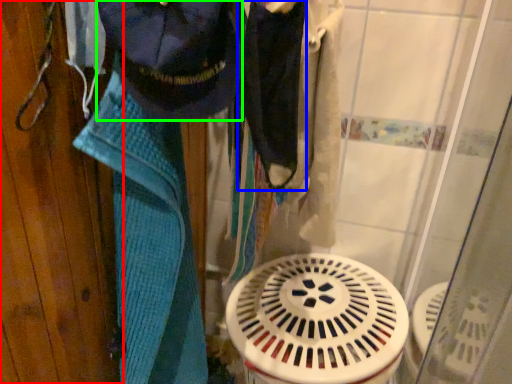
Question: Based on their relative distances, which object is nearer to door (highlighted by a red box)? Choose from clothing (highlighted by a blue box) and clothing (highlighted by a green box).

Choices:
 (A) clothing
 (B) clothing

Answer: (B)